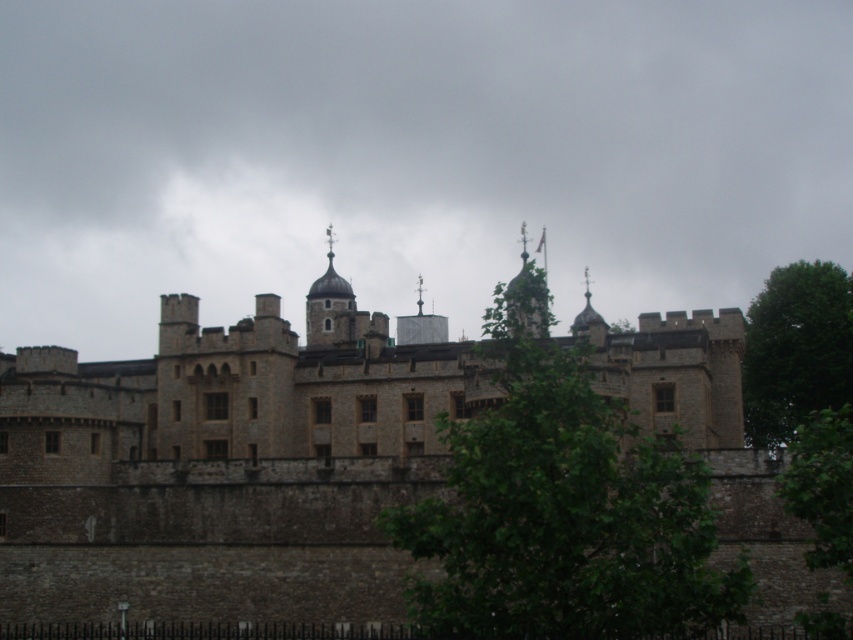
You are a tourist standing in front of the stone castle at center. You want to take a photo of the castle without any obstructions. Is the green leafy tree at right blocking your view of the castle?

The stone castle at center is in front of the green leafy tree at right, so the tree is behind the castle and not blocking your view.

You are standing in front of the castle and notice two green leafy trees. Which tree, the green leafy tree at center or the green leafy tree at right, is closer to you?

The green leafy tree at center is closer to the viewer than the green leafy tree at right.

You are a tourist standing in front of the stone castle at center. You notice a green leafy tree at right. Which object is higher in the image?

The green leafy tree at right is higher than the stone castle at center.